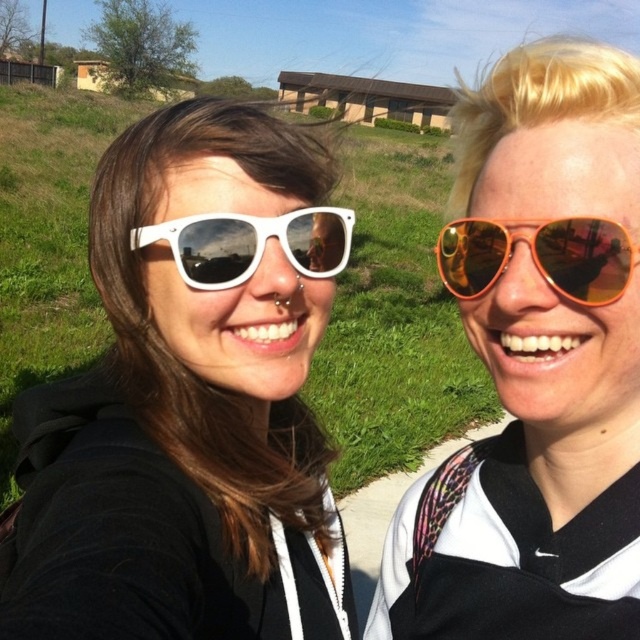
Does orange reflective sunglasses at upper right appear over orange reflective sunglasses at right?

No.

Between orange reflective sunglasses at upper right and orange reflective sunglasses at right, which one appears on the right side from the viewer's perspective?

Positioned to the right is orange reflective sunglasses at upper right.

Does point (557, 269) come in front of point (602, 266)?

No, (557, 269) is behind (602, 266).

You are a GUI agent. You are given a task and a screenshot of the screen. Output one action in this format:
    pyautogui.click(x=<x>, y=<y>)
    Task: Click on the orange reflective sunglasses at upper right
    
    Given the screenshot: What is the action you would take?
    pyautogui.click(x=536, y=365)

Can you confirm if white matte sunglasses at upper left is wider than orange reflective sunglasses at right?

Yes, white matte sunglasses at upper left is wider than orange reflective sunglasses at right.

Can you confirm if white matte sunglasses at upper left is smaller than orange reflective sunglasses at right?

Actually, white matte sunglasses at upper left might be larger than orange reflective sunglasses at right.

The image size is (640, 640). Describe the element at coordinates (189, 401) in the screenshot. I see `white matte sunglasses at upper left` at that location.

This screenshot has height=640, width=640. I want to click on white matte sunglasses at upper left, so click(189, 401).

Which is below, white matte sunglasses at upper left or orange reflective sunglasses at upper right?

orange reflective sunglasses at upper right

Does white matte sunglasses at upper left lie in front of orange reflective sunglasses at upper right?

Yes, it is in front of orange reflective sunglasses at upper right.

Which is behind, point (160, 513) or point (548, 250)?

Positioned behind is point (160, 513).

Where is `white matte sunglasses at upper left`? This screenshot has height=640, width=640. white matte sunglasses at upper left is located at coordinates (189, 401).